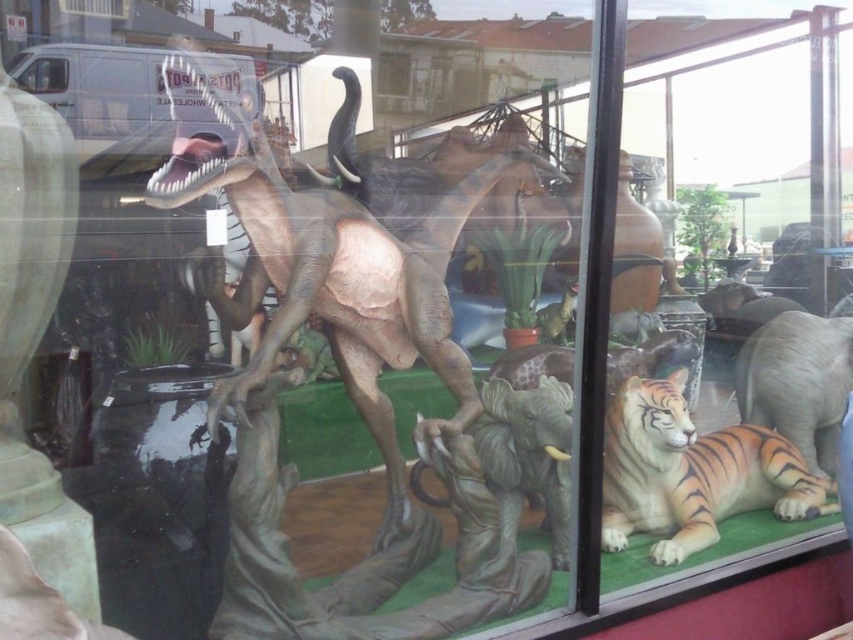
Question: Does smooth gray dinosaur at center have a smaller size compared to orange striped fur at lower right?

Choices:
 (A) no
 (B) yes

Answer: (A)

Question: Which point is closer to the camera?

Choices:
 (A) (682, 376)
 (B) (310, 204)

Answer: (B)

Question: Is smooth gray dinosaur at center to the right of orange striped fur at lower right from the viewer's perspective?

Choices:
 (A) no
 (B) yes

Answer: (A)

Question: Which object is farther from the camera taking this photo?

Choices:
 (A) orange striped fur at lower right
 (B) smooth gray dinosaur at center

Answer: (A)

Question: Which object is farther from the camera taking this photo?

Choices:
 (A) smooth gray dinosaur at center
 (B) orange striped fur at lower right

Answer: (B)

Question: Can you confirm if smooth gray dinosaur at center is thinner than orange striped fur at lower right?

Choices:
 (A) yes
 (B) no

Answer: (B)